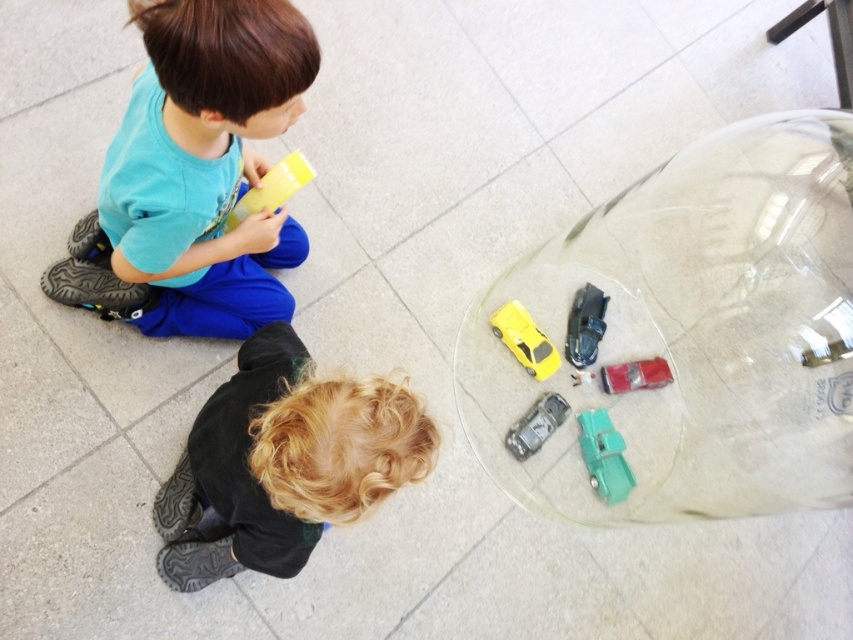
The width and height of the screenshot is (853, 640). What do you see at coordinates (195, 173) in the screenshot?
I see `matte blue shirt at upper left` at bounding box center [195, 173].

Between matte blue shirt at upper left and blonde curly hair at lower center, which one is positioned lower?

blonde curly hair at lower center

The image size is (853, 640). What are the coordinates of `matte blue shirt at upper left` in the screenshot? It's located at [195, 173].

In order to click on matte blue shirt at upper left in this screenshot , I will do `click(195, 173)`.

Can you confirm if transparent glass bubble at center is taller than blonde curly hair at lower center?

Indeed, transparent glass bubble at center has a greater height compared to blonde curly hair at lower center.

Which is more to the left, transparent glass bubble at center or blonde curly hair at lower center?

blonde curly hair at lower center

Locate an element on the screen. transparent glass bubble at center is located at coordinates (693, 332).

This screenshot has height=640, width=853. Identify the location of transparent glass bubble at center. (693, 332).

Who is positioned more to the right, yellow matte car at lower center or metallic silver toy car at lower center?

Positioned to the right is metallic silver toy car at lower center.

Can you confirm if yellow matte car at lower center is taller than metallic silver toy car at lower center?

Correct, yellow matte car at lower center is much taller as metallic silver toy car at lower center.

Identify the location of yellow matte car at lower center. (524, 339).